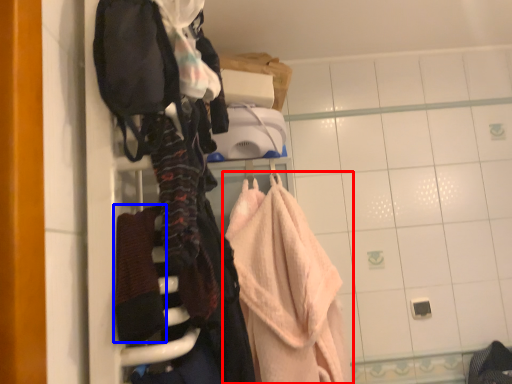
Question: Among these objects, which one is nearest to the camera, towel (highlighted by a red box) or bath towel (highlighted by a blue box)?

Choices:
 (A) towel
 (B) bath towel

Answer: (B)